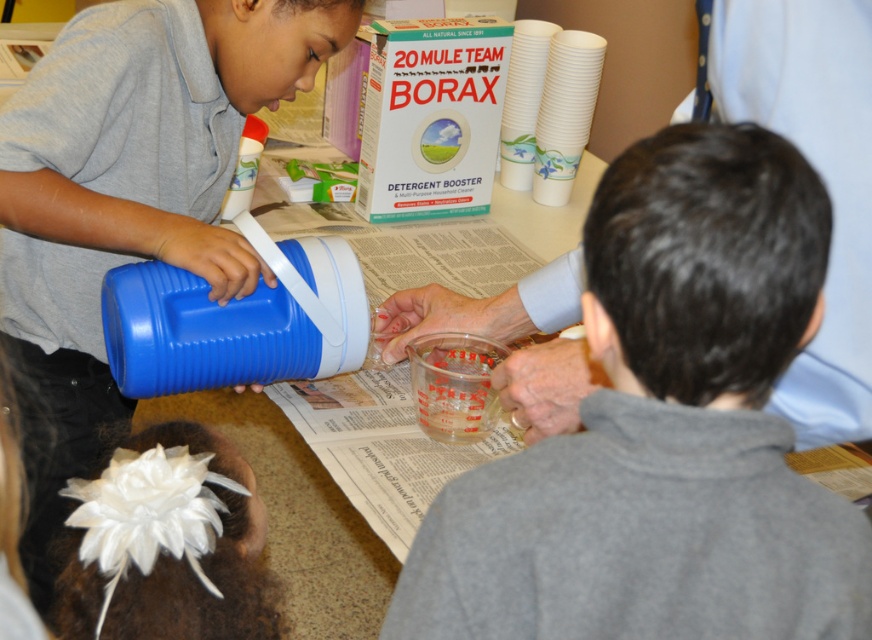
You are a teacher observing an experiment. You notice the gray fleece sweatshirt at center and the matte blue thermos at left. Which object is positioned lower in the image?

The gray fleece sweatshirt at center is positioned below the matte blue thermos at left, so it is lower in the image.

You are a robot with a 60 cm wide arm. You need to place an object between the gray fleece sweatshirt at center and the matte blue thermos at left. Can your arm fit through the space between them?

The space between the gray fleece sweatshirt at center and the matte blue thermos at left is 70.14 centimeters. Since your arm is 60 cm wide, it can fit through the space between them as the distance is greater than the arm width.

You are observing a demonstration where two points are marked in the scene. Which of the two points, point 1 at coordinates point (685, 564) or point 2 at coordinates point (94, 58), is closer to the camera?

Point 1 at coordinates point (685, 564) is closer to the camera than point 2 at coordinates point (94, 58).